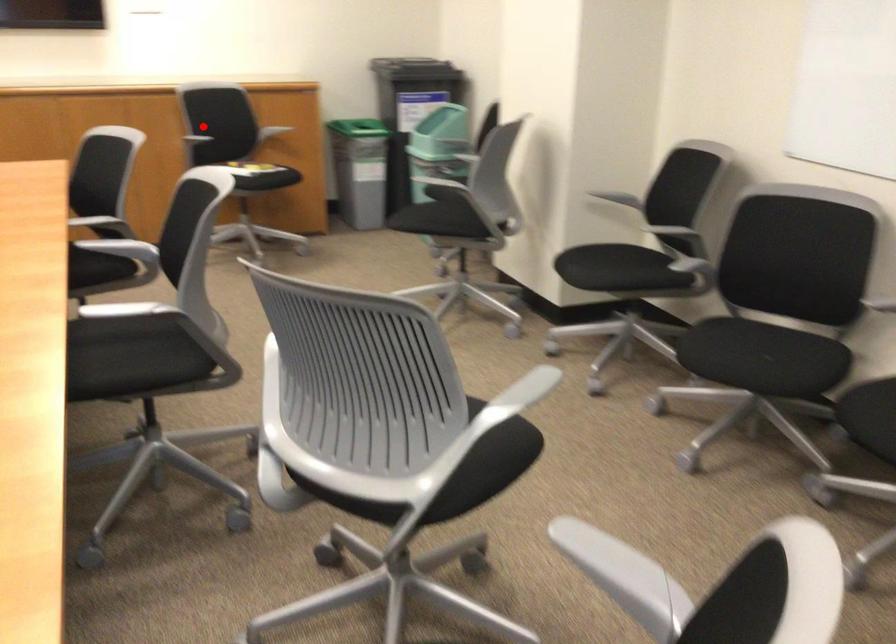
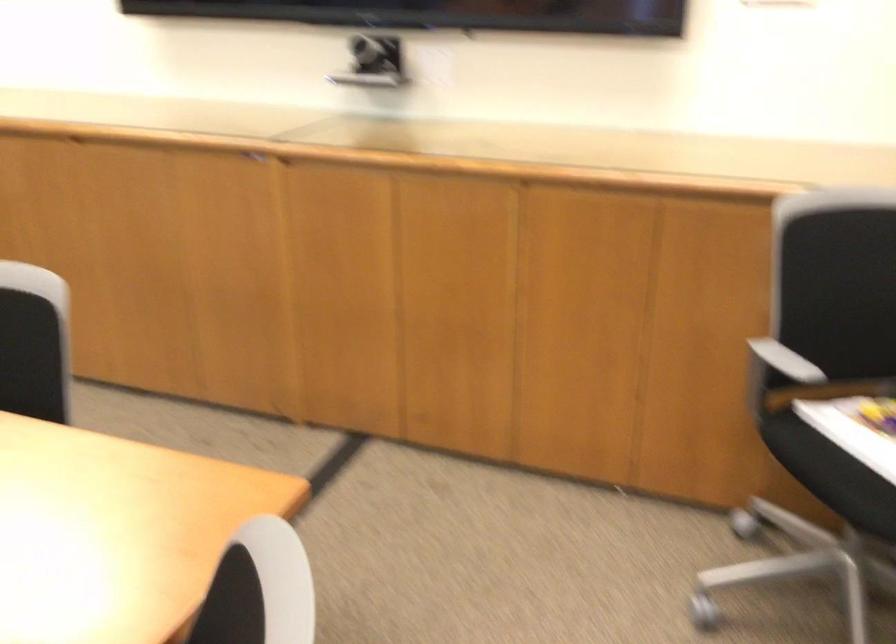
Locate, in the second image, the point that corresponds to the highlighted location in the first image.

(778, 374)